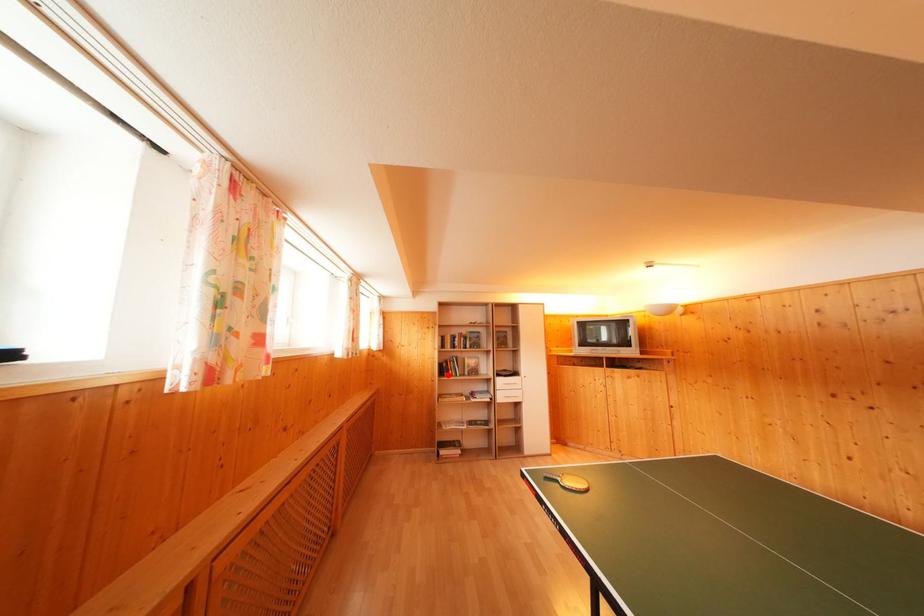
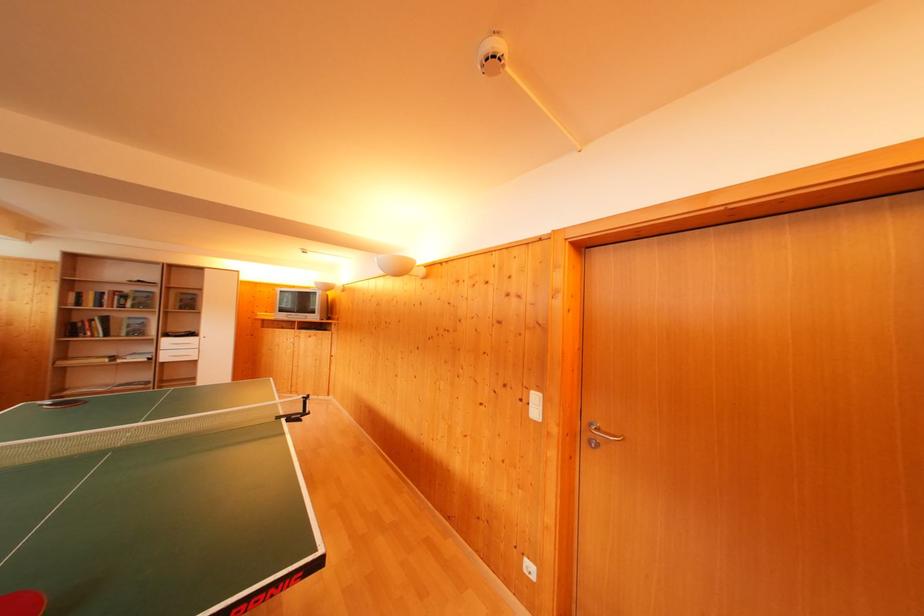
Question: I am providing you with two images of the same scene from different viewpoints. A red point is marked on the first image. Is the red point's position out of view in image 2?

Choices:
 (A) Yes
 (B) No

Answer: (B)